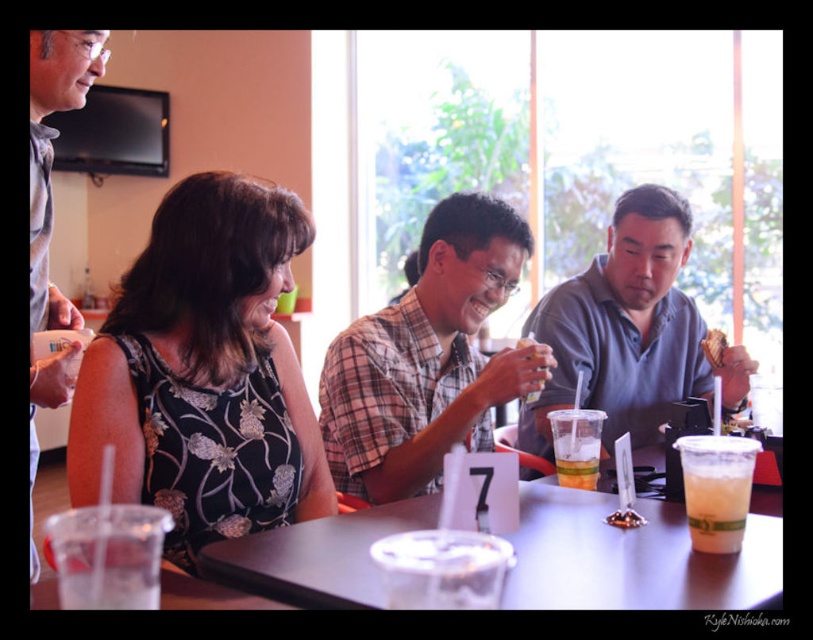
Question: Can you confirm if plaid fabric shirt at center is positioned below yellow cake at center?

Choices:
 (A) yes
 (B) no

Answer: (A)

Question: Does clear plastic table at center have a smaller size compared to yellow cake at center?

Choices:
 (A) no
 (B) yes

Answer: (A)

Question: Where is brown crumbly bread at right located in relation to yellow cake at center in the image?

Choices:
 (A) below
 (B) above

Answer: (B)

Question: Which object is closer to the camera taking this photo?

Choices:
 (A) clear plastic cup at table right
 (B) translucent plastic cup at center
 (C) clear plastic table at center
 (D) gray shirt at upper left

Answer: (C)

Question: Which of these objects is positioned closest to the translucent plastic cup at center?

Choices:
 (A) black floral dress at center
 (B) gray shirt at upper left
 (C) clear plastic cup at center

Answer: (C)

Question: Among these points, which one is nearest to the camera?

Choices:
 (A) (489, 584)
 (B) (590, 444)

Answer: (A)